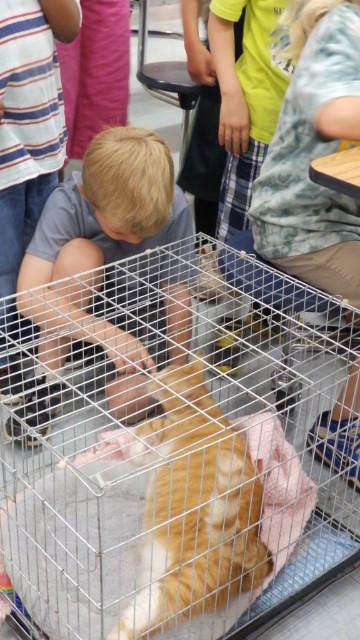
From the picture: You are a teacher in the classroom and want to ensure the safety of both the silver wire bird cage at center and the orange fur cat at center. Based on their positions, which object is closer to you and might require closer supervision?

The silver wire bird cage at center is in front of the orange fur cat at center, so the silver wire bird cage at center is closer to you and requires closer supervision.

You are a teacher in the classroom and want to ensure the safety of the children. The silver wire bird cage at center and the light brown hair at center are both in the same area. Which object is located to the right of the other?

The silver wire bird cage at center is positioned on the right side of light brown hair at center, so the bird cage is to the right of the child with light brown hair.

You are standing in the classroom scene and want to determine the relative positions of two points. Which point is closer to you, point (276,440) or point (218,525)?

Point (276,440) is further to the viewer than point (218,525), so point (218,525) is closer to you.